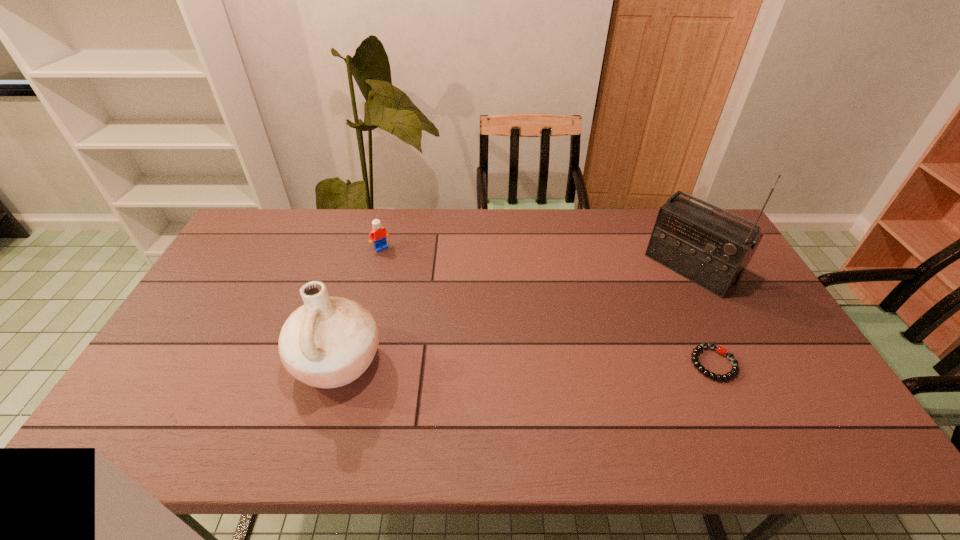
Locate an element on the screen. pottery is located at coordinates (328, 342).

Image resolution: width=960 pixels, height=540 pixels. What are the coordinates of `the shortest object` in the screenshot? It's located at (695, 354).

Locate an element on the screen. Lego is located at coordinates (379, 234).

Image resolution: width=960 pixels, height=540 pixels. I want to click on the tallest object, so click(713, 251).

This screenshot has height=540, width=960. Find the location of `free space located 0.150m to pour from the handle of the third shortest object`. free space located 0.150m to pour from the handle of the third shortest object is located at coordinates (235, 362).

Find the location of a particular element. The image size is (960, 540). free spot located to pour from the handle of the third shortest object is located at coordinates (160, 362).

The image size is (960, 540). Find the location of `free space located to pour from the handle of the third shortest object`. free space located to pour from the handle of the third shortest object is located at coordinates (182, 362).

Locate an element on the screen. This screenshot has height=540, width=960. vacant region located on the back of the shortest object is located at coordinates (669, 269).

Locate an element on the screen. vacant space located 0.130m on the face of the Lego is located at coordinates (405, 273).

The image size is (960, 540). In order to click on vacant space situated 0.090m on the face of the Lego in this screenshot , I will do `click(398, 266)`.